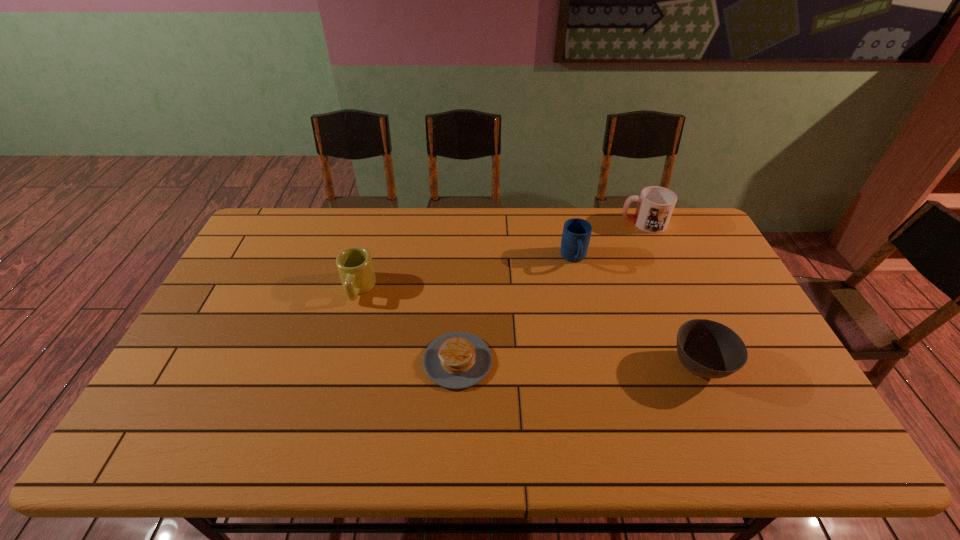
This screenshot has height=540, width=960. In order to click on vacant space at the far right corner of the desktop in this screenshot , I will do `click(668, 242)`.

In the image, there is a desktop. What are the coordinates of `vacant area at the near right corner` in the screenshot? It's located at (823, 443).

Where is `vacant space that's between the pancake and the leftmost object`? The width and height of the screenshot is (960, 540). vacant space that's between the pancake and the leftmost object is located at coordinates (408, 325).

Identify the location of free space that is in between the third object from left to right and the pancake. This screenshot has height=540, width=960. (516, 310).

Identify the location of vacant space that is in between the second mug from right to left and the second object from left to right. (516, 310).

The width and height of the screenshot is (960, 540). Find the location of `vacant area that lies between the second mug from left to right and the pancake`. vacant area that lies between the second mug from left to right and the pancake is located at coordinates (516, 310).

Locate an element on the screen. vacant point located between the farthest object and the fourth object from right to left is located at coordinates (550, 292).

The width and height of the screenshot is (960, 540). What are the coordinates of `unoccupied area between the leftmost mug and the third object from left to right` in the screenshot? It's located at (466, 273).

Where is `vacant space that's between the bowl and the farthest object`? The image size is (960, 540). vacant space that's between the bowl and the farthest object is located at coordinates (671, 295).

Where is `unoccupied area between the leftmost object and the pancake`? The width and height of the screenshot is (960, 540). unoccupied area between the leftmost object and the pancake is located at coordinates [408, 325].